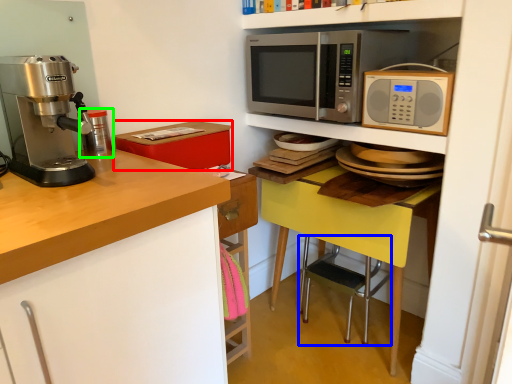
Question: Considering the real-world distances, which object is closest to box (highlighted by a red box)? step stool (highlighted by a blue box) or appliance (highlighted by a green box).

Choices:
 (A) step stool
 (B) appliance

Answer: (B)